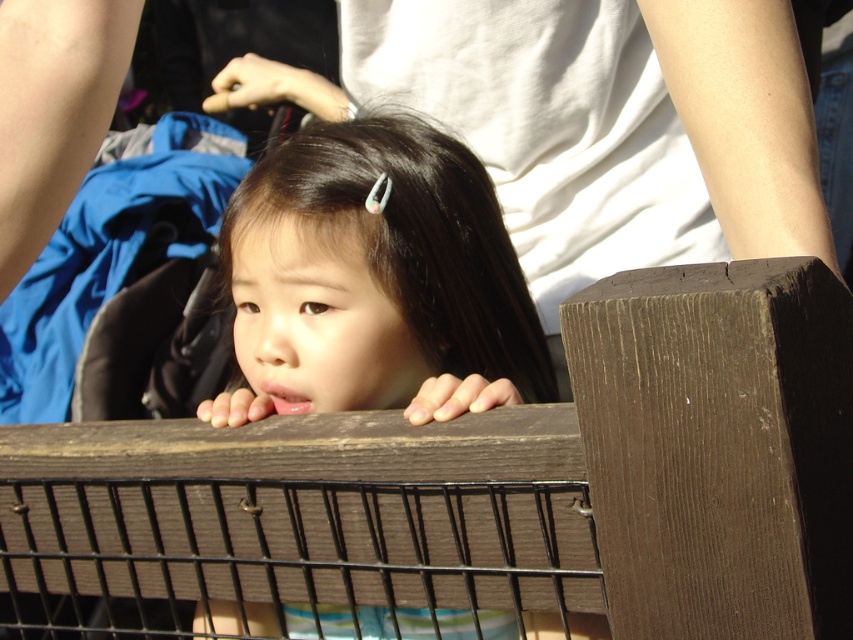
You are a parent trying to ensure your child is safe while they lean on the brown wooden fence at center with their smooth brown hair at center. Given that the distance between the two is 6.90 inches, is this distance sufficient to prevent the child from accidentally touching the fence?

The brown wooden fence at center is 6.90 inches away from the smooth brown hair at center. This distance is sufficient to prevent the child from accidentally touching the fence while leaning.

You are a photographer trying to capture the child peeking over the brown wooden fence at center. To ensure the fence is in focus, where should you position the camera focus point?

The brown wooden fence at center is located at point (503,480), so you should position the camera focus point at those coordinates to ensure the fence is in focus.

In the scene shown: You are a photographer trying to capture the child from above. Based on the scene, is the smooth brown hair at center visible above the brown wooden fence at center?

Yes, the smooth brown hair at center is visible above the brown wooden fence at center because the fence is positioned below the hair.